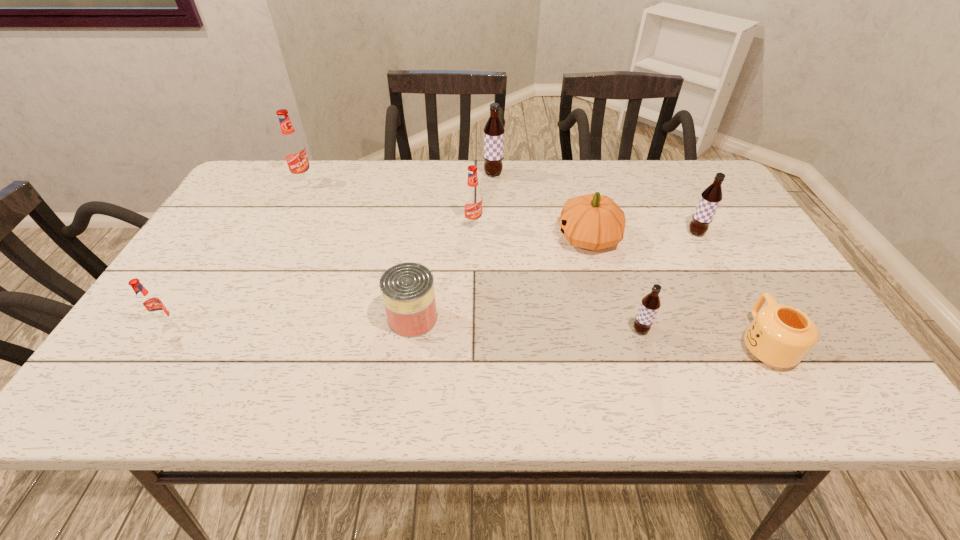
Identify the location of the second brown root beer from left to right. The width and height of the screenshot is (960, 540). (650, 304).

Image resolution: width=960 pixels, height=540 pixels. In order to click on the leftmost root beer in this screenshot , I will do `click(151, 305)`.

Identify the location of the leftmost object. [151, 305].

The width and height of the screenshot is (960, 540). Find the location of `the seventh object from right to left`. the seventh object from right to left is located at coordinates (407, 289).

Identify the location of mug. (780, 335).

Locate an element on the screen. This screenshot has height=540, width=960. vacant space located on the left of the fourth root beer from left to right is located at coordinates (442, 174).

Identify the location of blank space located 0.320m on the right of the eighth object from right to left. (418, 181).

Where is `free space located 0.180m on the front of the fourth root beer from right to left`? free space located 0.180m on the front of the fourth root beer from right to left is located at coordinates (472, 278).

This screenshot has height=540, width=960. In order to click on vacant space located 0.070m on the left of the rightmost root beer in this screenshot , I will do `click(660, 233)`.

Identify the location of blank area located on the side of the gourd with the carved face. The height and width of the screenshot is (540, 960). coord(537,238).